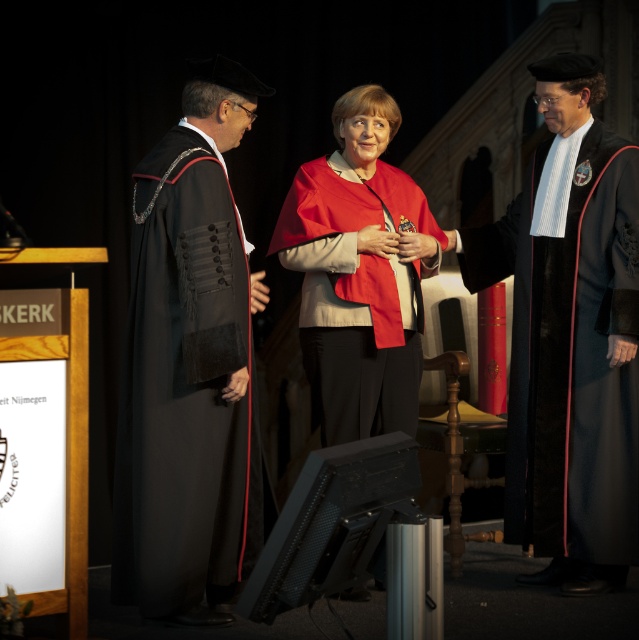
Question: Can you confirm if black velvet gown at right is smaller than matte red cape at center?

Choices:
 (A) no
 (B) yes

Answer: (A)

Question: Based on their relative distances, which object is nearer to the black velvet gown at right?

Choices:
 (A) matte red cape at center
 (B) black velvet gown at left

Answer: (A)

Question: Is black velvet gown at left positioned in front of black velvet gown at right?

Choices:
 (A) no
 (B) yes

Answer: (B)

Question: Which point appears farthest from the camera in this image?

Choices:
 (A) (185, 570)
 (B) (351, 236)
 (C) (482, 237)

Answer: (C)

Question: Is black velvet gown at right below matte red cape at center?

Choices:
 (A) no
 (B) yes

Answer: (B)

Question: Which is farther from the black velvet gown at left?

Choices:
 (A) matte red cape at center
 (B) black velvet gown at right

Answer: (B)